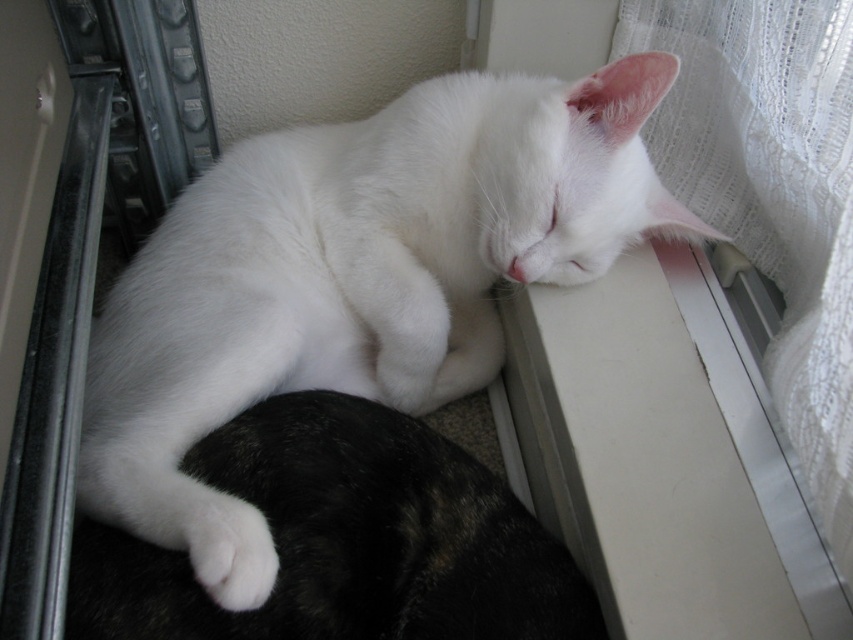
Is the position of white fur at center more distant than that of white lace curtain at upper right?

No, white fur at center is in front of white lace curtain at upper right.

Is white fur at center thinner than white lace curtain at upper right?

Incorrect, white fur at center's width is not less than white lace curtain at upper right's.

Locate an element on the screen. This screenshot has width=853, height=640. white fur at center is located at coordinates (344, 540).

The image size is (853, 640). I want to click on white fur at center, so click(x=344, y=540).

Does white fluffy cat at upper center have a lesser height compared to white lace curtain at upper right?

Indeed, white fluffy cat at upper center has a lesser height compared to white lace curtain at upper right.

Can you confirm if white fluffy cat at upper center is taller than white lace curtain at upper right?

No, white fluffy cat at upper center is not taller than white lace curtain at upper right.

Is point (486, 276) more distant than point (827, 128)?

Yes, it is behind point (827, 128).

At what (x,y) coordinates should I click in order to perform the action: click on white fluffy cat at upper center. Please return your answer as a coordinate pair (x, y). This screenshot has height=640, width=853. Looking at the image, I should click on (354, 280).

Consider the image. Between white fluffy cat at upper center and white fur at center, which one appears on the right side from the viewer's perspective?

white fur at center is more to the right.

Who is positioned more to the left, white fluffy cat at upper center or white fur at center?

Positioned to the left is white fluffy cat at upper center.

Who is more distant from viewer, (515, 140) or (306, 598)?

Point (515, 140)

Find the location of `white fluffy cat at upper center`. white fluffy cat at upper center is located at coordinates (354, 280).